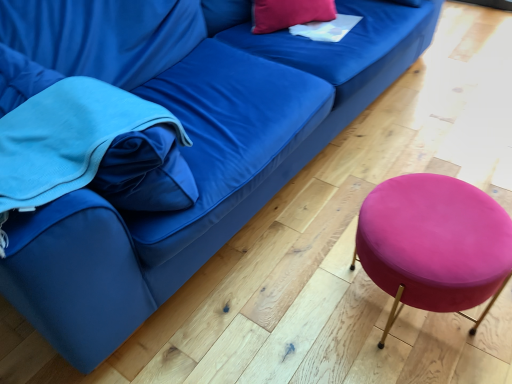
Question: Looking at their shapes, would you say velvet pink stool at lower right is wider or thinner than matte pink pillow at upper center?

Choices:
 (A) wide
 (B) thin

Answer: (A)

Question: Considering the relative positions of velvet pink stool at lower right and matte pink pillow at upper center in the image provided, is velvet pink stool at lower right to the left or to the right of matte pink pillow at upper center?

Choices:
 (A) left
 (B) right

Answer: (B)

Question: From the image's perspective, is velvet pink stool at lower right located above or below matte pink pillow at upper center?

Choices:
 (A) below
 (B) above

Answer: (A)

Question: Do you think matte pink pillow at upper center is within velvet pink stool at lower right, or outside of it?

Choices:
 (A) inside
 (B) outside

Answer: (B)

Question: From a real-world perspective, is matte pink pillow at upper center above or below velvet pink stool at lower right?

Choices:
 (A) below
 (B) above

Answer: (B)

Question: Considering the positions of matte pink pillow at upper center and velvet pink stool at lower right in the image, is matte pink pillow at upper center wider or thinner than velvet pink stool at lower right?

Choices:
 (A) wide
 (B) thin

Answer: (B)

Question: Considering the positions of point (315, 8) and point (392, 235), is point (315, 8) closer or farther from the camera than point (392, 235)?

Choices:
 (A) closer
 (B) farther

Answer: (B)